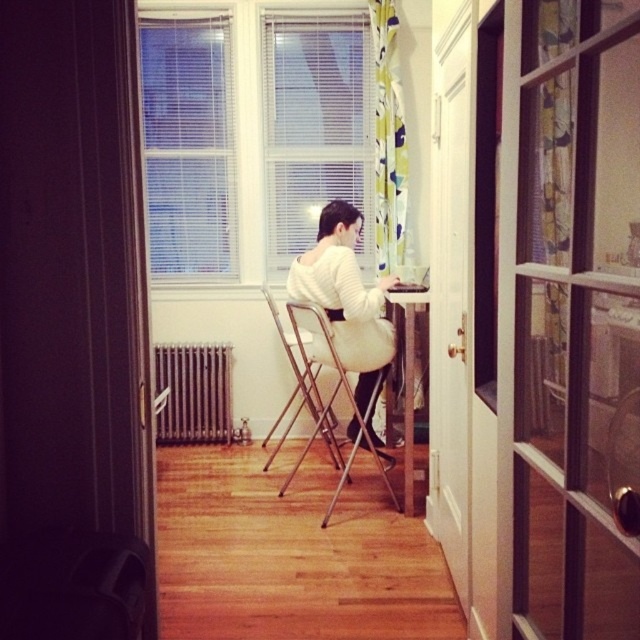
You are standing in the room and want to place a small decoration. You have two points marked in the room at coordinates point [563,32] and point [301,406]. Which point is closer to you?

Point [563,32] is closer to the camera than point [301,406], so the decoration placed at point [563,32] will be closer to you.

You are standing in the room and want to open the clear glass screen door at center. To do so, you first need to adjust the white blinds at upper center. Are the blinds in front of or behind the door?

The clear glass screen door at center is closer to the viewer than the white blinds at upper center, so the blinds are behind the door.